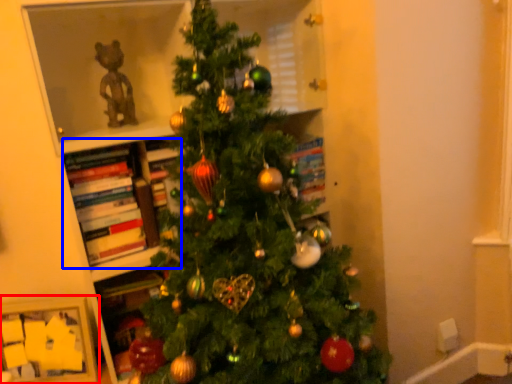
Question: Which of the following is the closest to the observer, picture frame (highlighted by a red box) or book (highlighted by a blue box)?

Choices:
 (A) picture frame
 (B) book

Answer: (B)